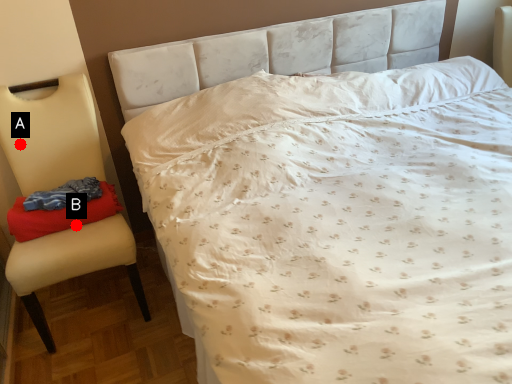
Question: Two points are circled on the image, labeled by A and B beside each circle. Which point is further to the camera?

Choices:
 (A) A is further
 (B) B is further

Answer: (A)